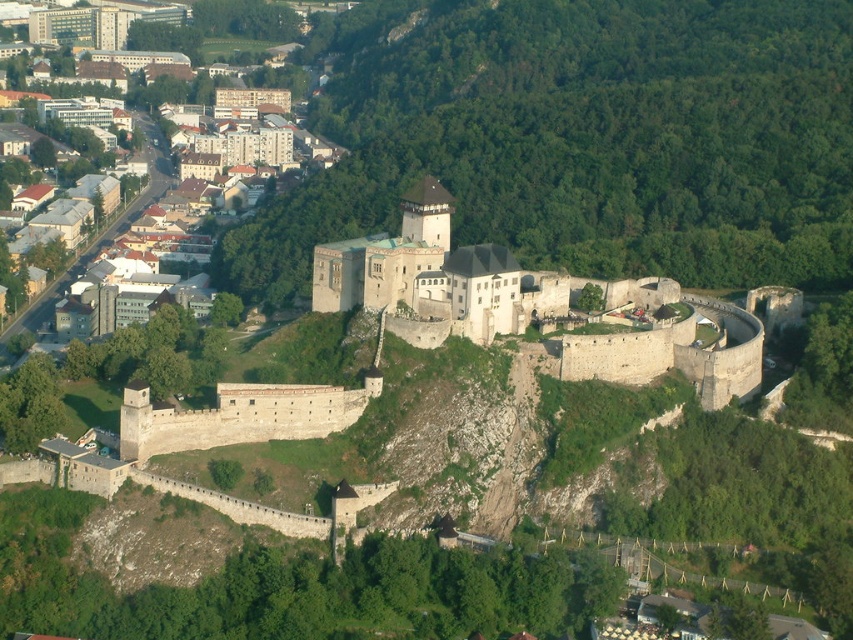
Question: Can you confirm if stone wall at center is bigger than light brown wooden houses at lower left?

Choices:
 (A) yes
 (B) no

Answer: (B)

Question: In this image, where is stone wall at center located relative to light brown wooden houses at lower left?

Choices:
 (A) right
 (B) left

Answer: (A)

Question: Is stone wall at center bigger than light brown wooden houses at lower left?

Choices:
 (A) no
 (B) yes

Answer: (A)